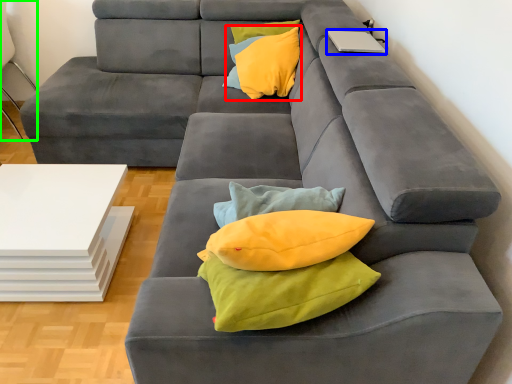
Question: Which is farther away from throw pillow (highlighted by a red box)? laptop (highlighted by a blue box) or armchair (highlighted by a green box)?

Choices:
 (A) laptop
 (B) armchair

Answer: (B)